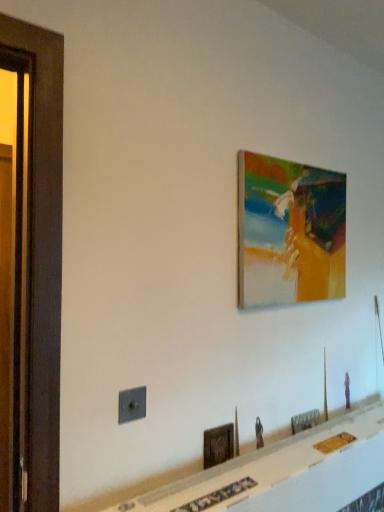
Measure the distance between point (x=258, y=303) and camera.

Point (x=258, y=303) and camera are 1.51 meters apart from each other.

How much space does wooden picture frame at lower center, placed as the 3th picture frame when sorted from top to bottom, occupy vertically?

It is 3.07 inches.

This screenshot has width=384, height=512. I want to click on wooden picture frame at lower center, which is the second picture frame in bottom-to-top order, so click(218, 445).

Image resolution: width=384 pixels, height=512 pixels. I want to click on matte acrylic painting at upper right, which is counted as the 2th picture frame, starting from the right, so click(289, 232).

Considering the positions of objects metallic gray outlet at lower left and wooden picture frame at lower center, which is the second picture frame in bottom-to-top order, in the image provided, who is more to the right, metallic gray outlet at lower left or wooden picture frame at lower center, which is the second picture frame in bottom-to-top order,?

Positioned to the right is wooden picture frame at lower center, which is the second picture frame in bottom-to-top order.

At what (x,y) coordinates should I click in order to perform the action: click on electric outlet in front of the wooden picture frame at lower center, which is the second picture frame in bottom-to-top order. Please return your answer as a coordinate pair (x, y). The height and width of the screenshot is (512, 384). Looking at the image, I should click on (131, 404).

From a real-world perspective, who is located higher, metallic gray outlet at lower left or wooden picture frame at lower center, the 1th picture frame from the left?

metallic gray outlet at lower left.

Between metallic gray outlet at lower left and wooden picture frame at lower center, the 1th picture frame from the left, which one has larger size?

wooden picture frame at lower center, the 1th picture frame from the left.

Could you tell me if matte acrylic painting at upper right, positioned as the second picture frame in left-to-right order, is facing wooden screen door at left?

No, matte acrylic painting at upper right, positioned as the second picture frame in left-to-right order, is not aimed at wooden screen door at left.

How far apart are matte acrylic painting at upper right, positioned as the second picture frame in left-to-right order, and wooden screen door at left?

matte acrylic painting at upper right, positioned as the second picture frame in left-to-right order, is 33.87 inches away from wooden screen door at left.

Is matte acrylic painting at upper right, positioned as the second picture frame in left-to-right order, beside wooden screen door at left?

matte acrylic painting at upper right, positioned as the second picture frame in left-to-right order, and wooden screen door at left are not in contact.

Can you confirm if matte acrylic painting at upper right, which is the 3th picture frame in bottom-to-top order, is positioned to the left of wooden screen door at left?

Incorrect, matte acrylic painting at upper right, which is the 3th picture frame in bottom-to-top order, is not on the left side of wooden screen door at left.

Relative to metallic gray outlet at lower left, is wooden screen door at left in front or behind?

In the image, wooden screen door at left appears in front of metallic gray outlet at lower left.

Does point (33, 222) lie in front of point (131, 418)?

That is True.

Is wooden screen door at left oriented towards metallic gray outlet at lower left?

No, wooden screen door at left is not oriented towards metallic gray outlet at lower left.

How different are the orientations of wooden screen door at left and metallic gray outlet at lower left in degrees?

There is a 2.11-degree angle between the facing directions of wooden screen door at left and metallic gray outlet at lower left.

Would you consider metallic gray outlet at lower left to be distant from wooden picture frame at lower center, which is counted as the third picture frame, starting from the left?

That's not correct — metallic gray outlet at lower left is a little close to wooden picture frame at lower center, which is counted as the third picture frame, starting from the left.

Is metallic gray outlet at lower left to the left or to the right of wooden picture frame at lower center, placed as the 3th picture frame when sorted from top to bottom, in the image?

metallic gray outlet at lower left is to the left of wooden picture frame at lower center, placed as the 3th picture frame when sorted from top to bottom.

Is metallic gray outlet at lower left shorter than wooden picture frame at lower center, the first picture frame when ordered from bottom to top?

No, metallic gray outlet at lower left is not shorter than wooden picture frame at lower center, the first picture frame when ordered from bottom to top.

Considering the relative sizes of metallic gray outlet at lower left and wooden picture frame at lower center, placed as the 3th picture frame when sorted from top to bottom, in the image provided, is metallic gray outlet at lower left bigger than wooden picture frame at lower center, placed as the 3th picture frame when sorted from top to bottom,?

Actually, metallic gray outlet at lower left might be smaller than wooden picture frame at lower center, placed as the 3th picture frame when sorted from top to bottom.

Locate an element on the screen. the 2nd picture frame behind the metallic gray outlet at lower left, starting your count from the anchor is located at coordinates (289, 232).

Does metallic gray outlet at lower left have a smaller size compared to matte acrylic painting at upper right, which is counted as the 2th picture frame, starting from the right?

Indeed, metallic gray outlet at lower left has a smaller size compared to matte acrylic painting at upper right, which is counted as the 2th picture frame, starting from the right.

Which point is more distant from viewer, (122, 407) or (305, 256)?

The point (305, 256) is farther from the camera.

Image resolution: width=384 pixels, height=512 pixels. What are the coordinates of `the 2nd picture frame to the left when counting from the wooden picture frame at lower center, placed as the 3th picture frame when sorted from top to bottom` in the screenshot? It's located at (218, 445).

Considering the sizes of objects wooden picture frame at lower center, the 1th picture frame from the left, and wooden picture frame at lower center, placed as the 3th picture frame when sorted from top to bottom, in the image provided, who is shorter, wooden picture frame at lower center, the 1th picture frame from the left, or wooden picture frame at lower center, placed as the 3th picture frame when sorted from top to bottom,?

Standing shorter between the two is wooden picture frame at lower center, placed as the 3th picture frame when sorted from top to bottom.

From the image's perspective, which one is positioned lower, wooden picture frame at lower center, placed as the third picture frame when sorted from right to left, or wooden picture frame at lower center, the first picture frame when ordered from bottom to top?

wooden picture frame at lower center, the first picture frame when ordered from bottom to top, appears lower in the image.

Is wooden picture frame at lower center, the 1th picture frame from the left, situated inside wooden picture frame at lower center, arranged as the 1th picture frame when viewed from the right, or outside?

wooden picture frame at lower center, the 1th picture frame from the left, is spatially situated outside wooden picture frame at lower center, arranged as the 1th picture frame when viewed from the right.

From the image's perspective, between wooden picture frame at lower center, placed as the 3th picture frame when sorted from top to bottom, and wooden screen door at left, which one is located above?

From the image's view, wooden screen door at left is above.

Are wooden picture frame at lower center, arranged as the 1th picture frame when viewed from the right, and wooden screen door at left far apart?

Yes, wooden picture frame at lower center, arranged as the 1th picture frame when viewed from the right, is far from wooden screen door at left.

Do you think wooden picture frame at lower center, which is counted as the third picture frame, starting from the left, is within wooden screen door at left, or outside of it?

wooden picture frame at lower center, which is counted as the third picture frame, starting from the left, is located beyond the bounds of wooden screen door at left.

At what (x,y) coordinates should I click in order to perform the action: click on the 1st picture frame to the right when counting from the metallic gray outlet at lower left. Please return your answer as a coordinate pair (x, y). Looking at the image, I should click on (218, 445).

Locate an element on the screen. the 2nd picture frame behind when counting from the wooden screen door at left is located at coordinates point(289,232).

When comparing their distances from wooden screen door at left, does wooden picture frame at lower center, which is counted as the third picture frame, starting from the left, or wooden picture frame at lower center, the 1th picture frame from the left, seem further?

wooden picture frame at lower center, which is counted as the third picture frame, starting from the left, lies further to wooden screen door at left than the other object.

Considering their positions, is wooden picture frame at lower center, placed as the second picture frame when sorted from top to bottom, positioned closer to wooden screen door at left than wooden picture frame at lower center, the first picture frame when ordered from bottom to top?

wooden picture frame at lower center, placed as the second picture frame when sorted from top to bottom, is positioned closer to the anchor wooden screen door at left.

Estimate the real-world distances between objects in this image. Which object is closer to wooden screen door at left, wooden picture frame at lower center, which is counted as the third picture frame, starting from the left, or matte acrylic painting at upper right, positioned as the second picture frame in left-to-right order?

Based on the image, matte acrylic painting at upper right, positioned as the second picture frame in left-to-right order, appears to be nearer to wooden screen door at left.

Considering their positions, is wooden screen door at left positioned closer to wooden picture frame at lower center, which is counted as the third picture frame, starting from the left, than wooden picture frame at lower center, which is the second picture frame in bottom-to-top order?

Based on the image, wooden picture frame at lower center, which is the second picture frame in bottom-to-top order, appears to be nearer to wooden picture frame at lower center, which is counted as the third picture frame, starting from the left.

When comparing their distances from metallic gray outlet at lower left, does wooden screen door at left or wooden picture frame at lower center, arranged as the 1th picture frame when viewed from the right, seem further?

wooden picture frame at lower center, arranged as the 1th picture frame when viewed from the right, is positioned further to the anchor metallic gray outlet at lower left.

Considering their positions, is wooden screen door at left positioned closer to metallic gray outlet at lower left than wooden picture frame at lower center, placed as the second picture frame when sorted from top to bottom?

wooden picture frame at lower center, placed as the second picture frame when sorted from top to bottom, is closer to metallic gray outlet at lower left.

When comparing their distances from wooden picture frame at lower center, arranged as the 1th picture frame when viewed from the right, does wooden screen door at left or metallic gray outlet at lower left seem further?

wooden screen door at left is further to wooden picture frame at lower center, arranged as the 1th picture frame when viewed from the right.

Which object lies nearer to the anchor point wooden picture frame at lower center, which is counted as the third picture frame, starting from the left, matte acrylic painting at upper right, positioned as the second picture frame in left-to-right order, or metallic gray outlet at lower left?

Among the two, matte acrylic painting at upper right, positioned as the second picture frame in left-to-right order, is located nearer to wooden picture frame at lower center, which is counted as the third picture frame, starting from the left.

This screenshot has height=512, width=384. I want to click on electric outlet between matte acrylic painting at upper right, which is the 1th picture frame in top-to-bottom order, and wooden picture frame at lower center, the 1th picture frame from the left, vertically, so point(131,404).

Identify the location of electric outlet between wooden screen door at left and matte acrylic painting at upper right, positioned as the second picture frame in left-to-right order, in the horizontal direction. (131, 404).

Image resolution: width=384 pixels, height=512 pixels. Find the location of `electric outlet between wooden screen door at left and wooden picture frame at lower center, which is counted as the third picture frame, starting from the left, in the horizontal direction`. electric outlet between wooden screen door at left and wooden picture frame at lower center, which is counted as the third picture frame, starting from the left, in the horizontal direction is located at coordinates (131, 404).

I want to click on electric outlet that lies between wooden screen door at left and wooden picture frame at lower center, which is the second picture frame in bottom-to-top order, from top to bottom, so click(131, 404).